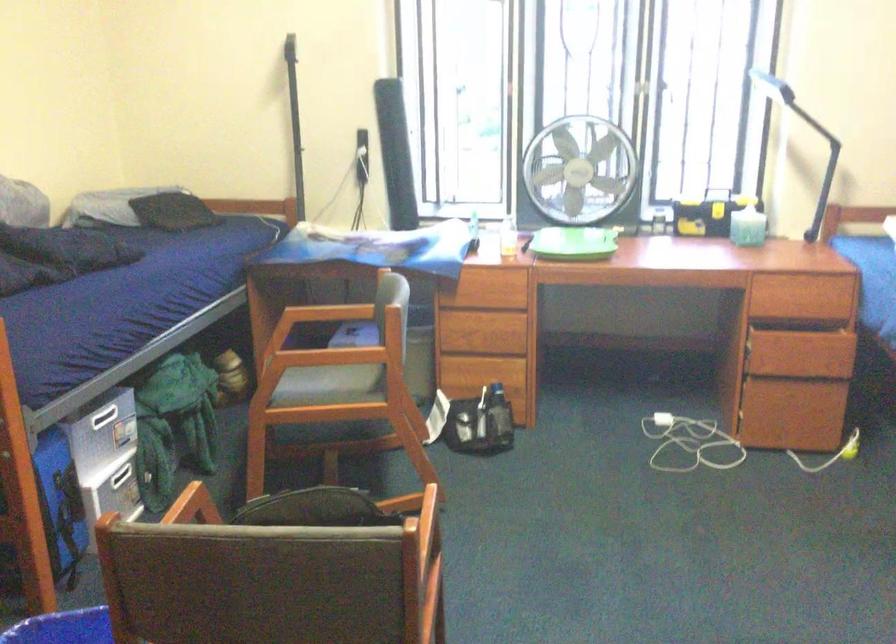
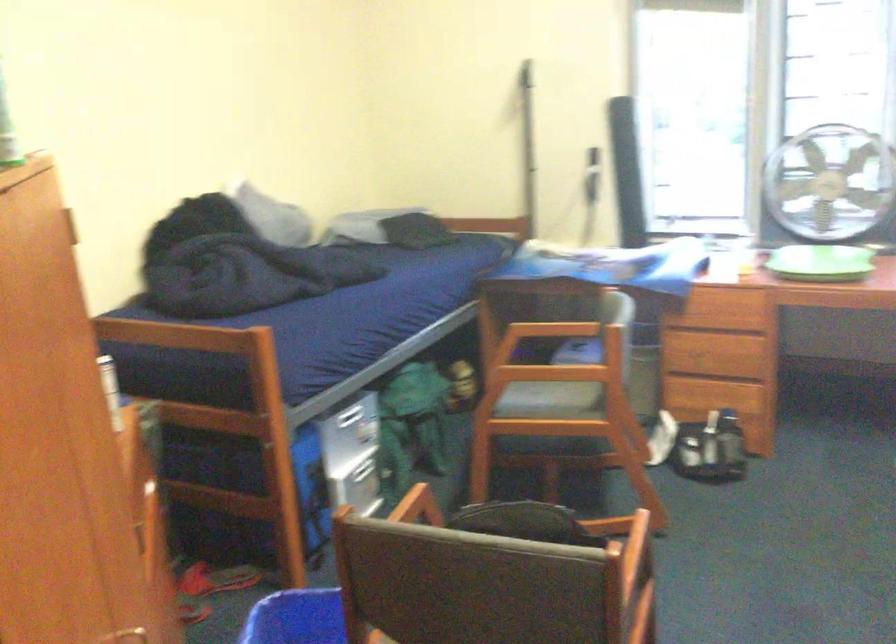
The images are taken continuously from a first-person perspective. In which direction are you moving?

The cameraman moved toward right, backward.